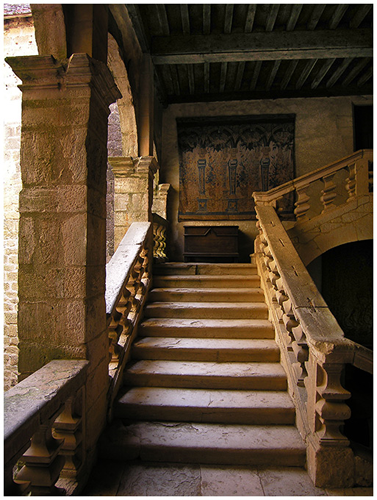
You are a GUI agent. You are given a task and a screenshot of the screen. Output one action in this format:
    pyautogui.click(x=<x>, y=<y>)
    Task: Click on the ceiling
    This screenshot has height=500, width=377.
    Given the screenshot: What is the action you would take?
    pyautogui.click(x=263, y=17), pyautogui.click(x=237, y=74), pyautogui.click(x=171, y=17), pyautogui.click(x=355, y=15), pyautogui.click(x=354, y=74), pyautogui.click(x=182, y=81)